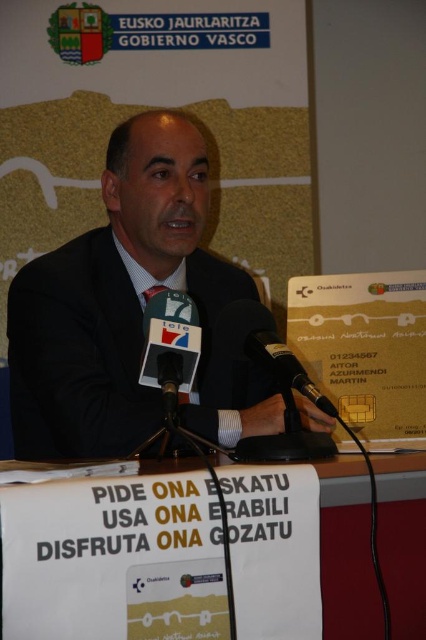
Find the location of a particular element. This screenshot has height=640, width=426. white paper at lower center is located at coordinates (112, 560).

Does white paper at lower center have a lesser height compared to black matte suit at center?

Yes.

Describe the element at coordinates (112, 560) in the screenshot. The width and height of the screenshot is (426, 640). I see `white paper at lower center` at that location.

Identify the location of white paper at lower center. This screenshot has height=640, width=426. (112, 560).

Does white paper at lower center have a greater width compared to black matte microphone at center?

Yes, white paper at lower center is wider than black matte microphone at center.

Which of these two, white paper at lower center or black matte microphone at center, stands taller?

Standing taller between the two is white paper at lower center.

You are a GUI agent. You are given a task and a screenshot of the screen. Output one action in this format:
    pyautogui.click(x=<x>, y=<y>)
    Task: Click on the white paper at lower center
    Image resolution: width=426 pixels, height=640 pixels.
    Given the screenshot: What is the action you would take?
    pyautogui.click(x=112, y=560)

Does black matte suit at center have a lesser width compared to black matte microphone at center?

In fact, black matte suit at center might be wider than black matte microphone at center.

Is black matte suit at center below black matte microphone at center?

No, black matte suit at center is not below black matte microphone at center.

Describe the element at coordinates (77, 355) in the screenshot. Image resolution: width=426 pixels, height=640 pixels. I see `black matte suit at center` at that location.

At what (x,y) coordinates should I click in order to perform the action: click on black matte suit at center. Please return your answer as a coordinate pair (x, y). The width and height of the screenshot is (426, 640). Looking at the image, I should click on (77, 355).